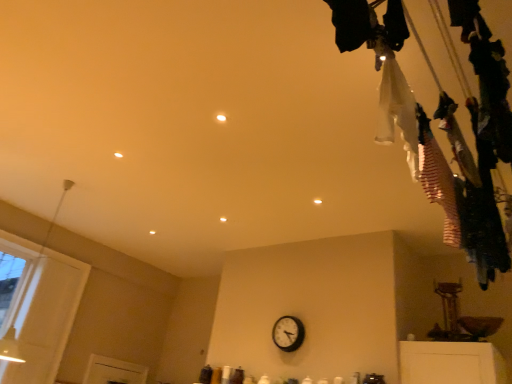
Question: Is white striped fabric at upper right, positioned as the 1th clothing in right-to-left order, in front of or behind white fabric at upper right, placed as the 1th clothing when sorted from left to right, in the image?

Choices:
 (A) front
 (B) behind

Answer: (B)

Question: From a real-world perspective, is white striped fabric at upper right, the second clothing from the left, physically located above or below white fabric at upper right, placed as the 1th clothing when sorted from left to right?

Choices:
 (A) below
 (B) above

Answer: (A)

Question: Estimate the real-world distances between objects in this image. Which object is farther from the black plastic wall clock at center?

Choices:
 (A) white fabric at upper right, placed as the 1th clothing when sorted from left to right
 (B) white striped fabric at upper right, the second clothing from the left

Answer: (A)

Question: Considering the real-world distances, which object is closest to the white fabric at upper right, the second clothing in the right-to-left sequence?

Choices:
 (A) black plastic wall clock at center
 (B) white striped fabric at upper right, the second clothing from the left

Answer: (B)